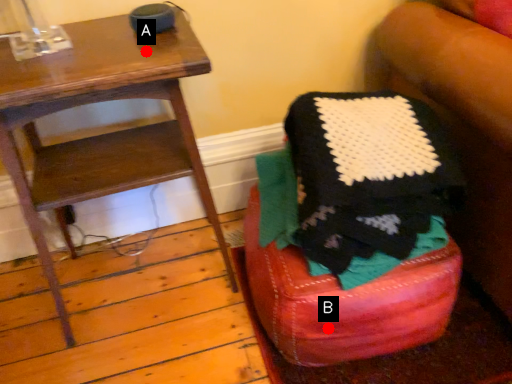
Question: Two points are circled on the image, labeled by A and B beside each circle. Which point is further to the camera?

Choices:
 (A) A is further
 (B) B is further

Answer: (B)